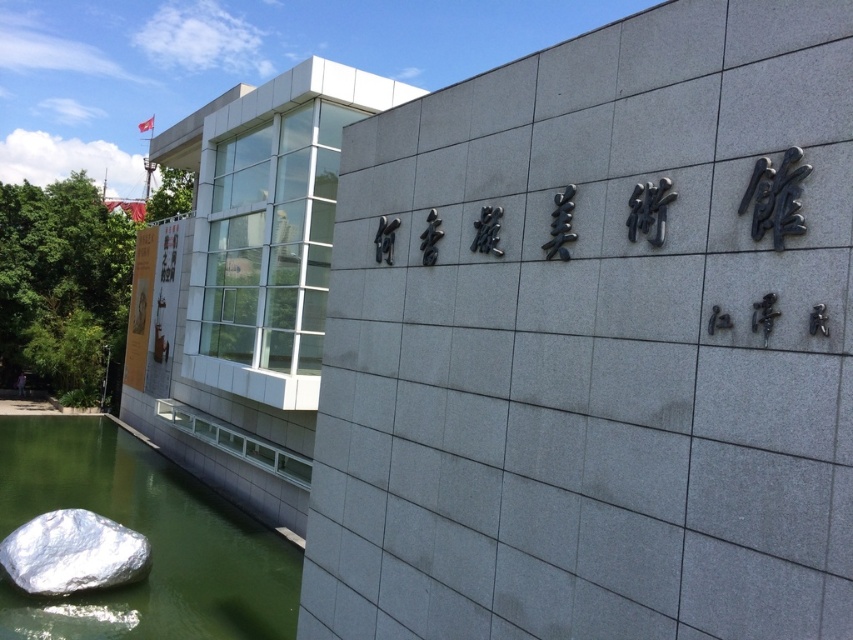
Question: Which object is farther from the camera taking this photo?

Choices:
 (A) green reflective water at lower left
 (B) shiny metallic rock at lower left

Answer: (B)

Question: Is green reflective water at lower left positioned before shiny metallic rock at lower left?

Choices:
 (A) yes
 (B) no

Answer: (A)

Question: Is green reflective water at lower left positioned behind shiny metallic rock at lower left?

Choices:
 (A) no
 (B) yes

Answer: (A)

Question: Which point is farther to the camera?

Choices:
 (A) shiny metallic rock at lower left
 (B) green reflective water at lower left

Answer: (A)

Question: Can you confirm if green reflective water at lower left is positioned above shiny metallic rock at lower left?

Choices:
 (A) no
 (B) yes

Answer: (A)

Question: Which point appears closest to the camera in this image?

Choices:
 (A) (186, 518)
 (B) (3, 554)

Answer: (B)